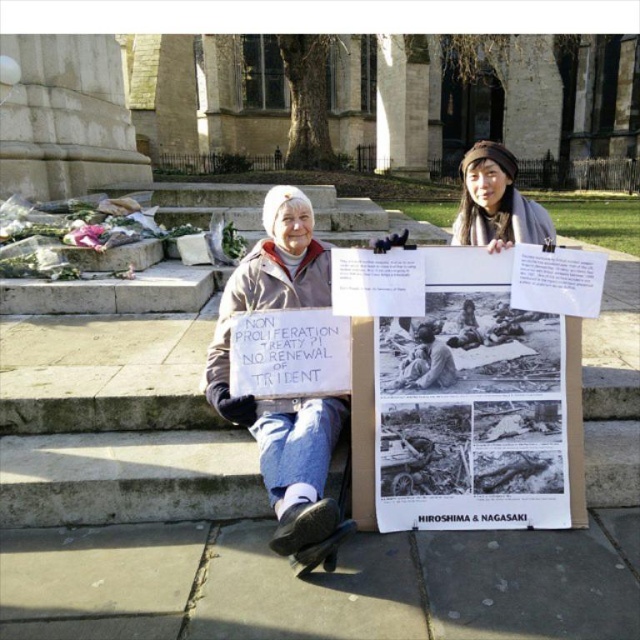
Is point (438, 280) less distant than point (412, 387)?

Yes, point (438, 280) is in front of point (412, 387).

Does black paper poster at center appear under black and white photograph of man at center?

Yes, black paper poster at center is below black and white photograph of man at center.

Which is behind, point (516, 419) or point (429, 324)?

Point (516, 419)

Locate an element on the screen. The image size is (640, 640). black paper poster at center is located at coordinates (476, 404).

Which is more to the left, denim jacket at center or brown woolen hat at upper center?

From the viewer's perspective, denim jacket at center appears more on the left side.

Which is behind, point (296, 406) or point (524, 208)?

The point (524, 208) is more distant.

Is point (218, 387) positioned behind point (483, 176)?

No, (218, 387) is closer to viewer.

Where is `denim jacket at center`? This screenshot has width=640, height=640. denim jacket at center is located at coordinates (285, 397).

Is black paper poster at center below denim jacket at center?

Indeed, black paper poster at center is positioned under denim jacket at center.

Can you confirm if black paper poster at center is shorter than denim jacket at center?

Yes.

Measure the distance between point (445, 518) and camera.

They are 4.01 meters apart.

Find the location of `black paper poster at center`. black paper poster at center is located at coordinates (476, 404).